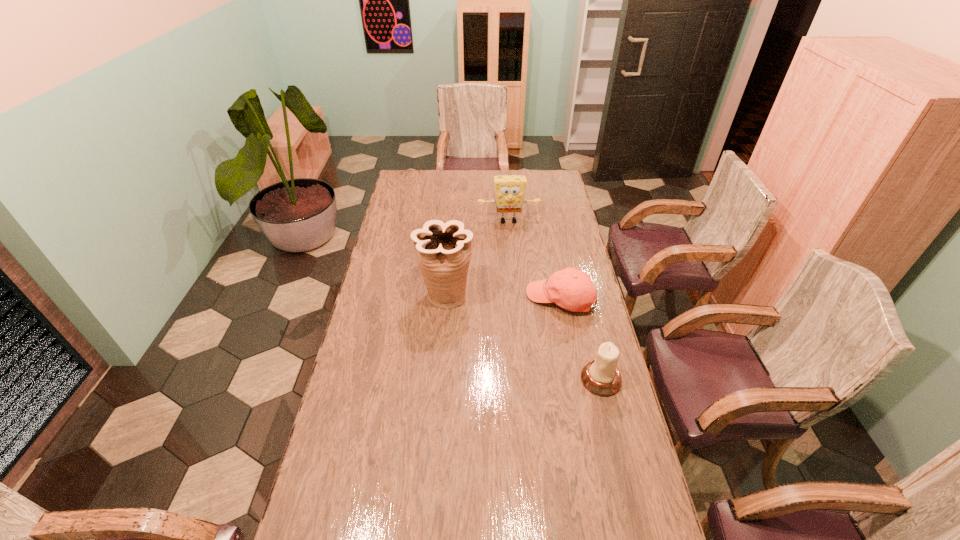
At what (x,y) coordinates should I click in order to perform the action: click on free location at the right edge. Please return your answer as a coordinate pair (x, y). This screenshot has width=960, height=540. Looking at the image, I should click on (586, 327).

Locate an element on the screen. The width and height of the screenshot is (960, 540). vacant space at the far left corner of the desktop is located at coordinates (398, 183).

At what (x,y) coordinates should I click in order to perform the action: click on free point between the shortest object and the second shortest object. Please return your answer as a coordinate pair (x, y). This screenshot has width=960, height=540. Looking at the image, I should click on (581, 339).

Locate an element on the screen. vacant area between the baseball cap and the candle holder is located at coordinates (581, 339).

The width and height of the screenshot is (960, 540). I want to click on vacant point located between the leftmost object and the shortest object, so (503, 298).

Where is `free space between the sponge and the shortest object`? The height and width of the screenshot is (540, 960). free space between the sponge and the shortest object is located at coordinates (534, 260).

Locate an element on the screen. The height and width of the screenshot is (540, 960). unoccupied area between the third shortest object and the shortest object is located at coordinates (534, 260).

At what (x,y) coordinates should I click in order to perform the action: click on free spot between the farthest object and the urn. Please return your answer as a coordinate pair (x, y). This screenshot has width=960, height=540. Looking at the image, I should click on (477, 258).

Locate an element on the screen. This screenshot has width=960, height=540. empty space that is in between the candle holder and the leftmost object is located at coordinates (523, 338).

Find the location of a particular element. The height and width of the screenshot is (540, 960). vacant space that is in between the shortest object and the candle holder is located at coordinates (581, 339).